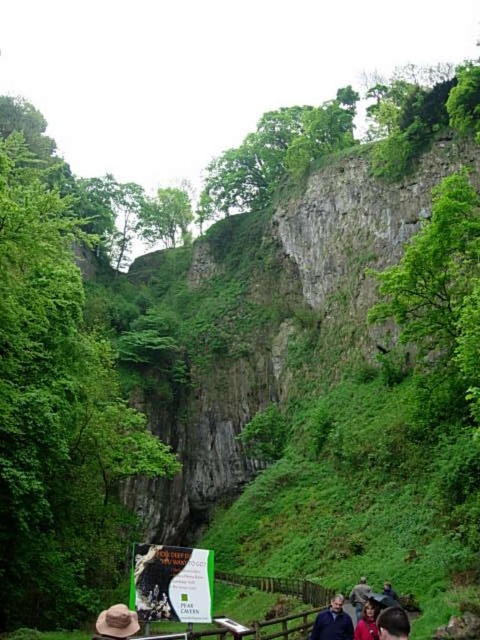
Question: From the image, what is the correct spatial relationship of white paper sign at center in relation to red fabric jacket at lower right?

Choices:
 (A) right
 (B) left

Answer: (B)

Question: Can you confirm if white paper sign at center is positioned to the right of red fabric jacket at lower right?

Choices:
 (A) yes
 (B) no

Answer: (B)

Question: Which object appears closest to the camera in this image?

Choices:
 (A) dark brown leather jacket at lower right
 (B) white paper sign at center
 (C) dark blue jacket at lower center
 (D) red fabric jacket at lower right

Answer: (D)

Question: Which of the following is the closest to the observer?

Choices:
 (A) (350, 627)
 (B) (363, 637)
 (C) (357, 604)
 (D) (170, 573)

Answer: (B)

Question: Is white paper sign at center bigger than dark blue jacket at lower center?

Choices:
 (A) yes
 (B) no

Answer: (B)

Question: Which of these objects is positioned farthest from the dark brown leather jacket at lower right?

Choices:
 (A) dark blue jacket at lower center
 (B) red fabric jacket at lower right

Answer: (B)